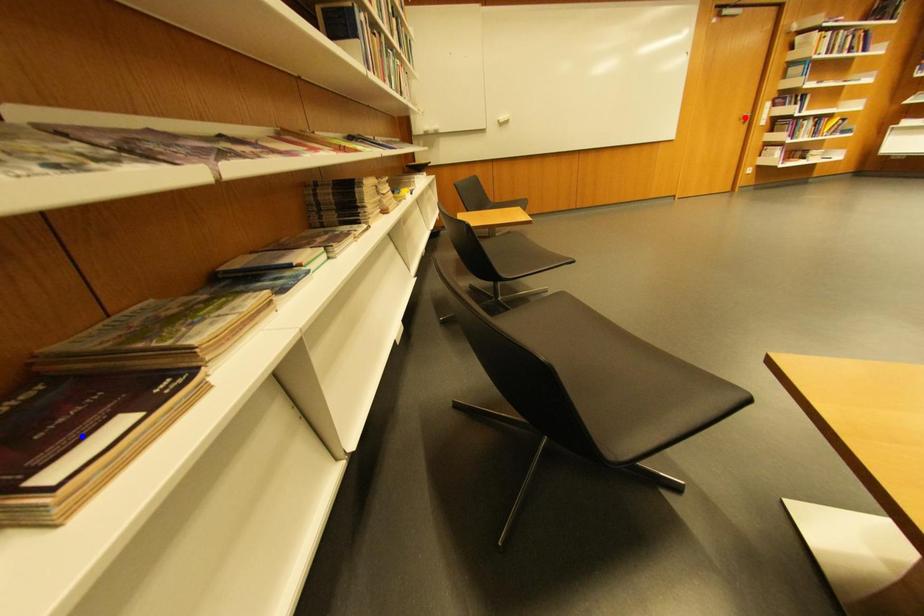
Question: Two points are marked on the image. Which point is closer to the camera?

Choices:
 (A) Blue point is closer.
 (B) Red point is closer.

Answer: (A)